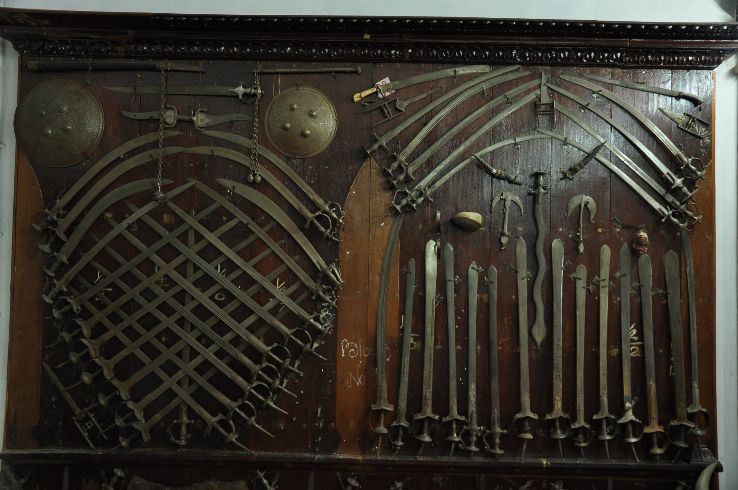
Locate an element on the screen. The width and height of the screenshot is (738, 490). wooden trim design is located at coordinates (680, 55).